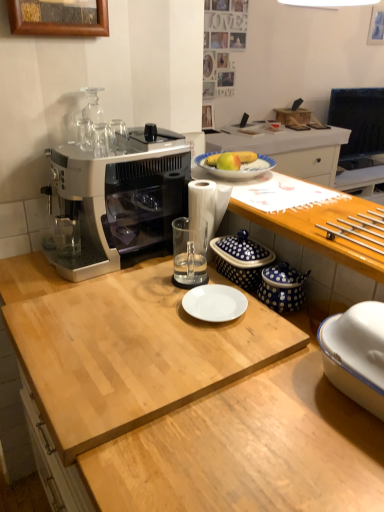
This screenshot has width=384, height=512. What are the coordinates of `vacant area in front of transparent glass at center, the first tableware in the bottom-to-top sequence` in the screenshot? It's located at (179, 321).